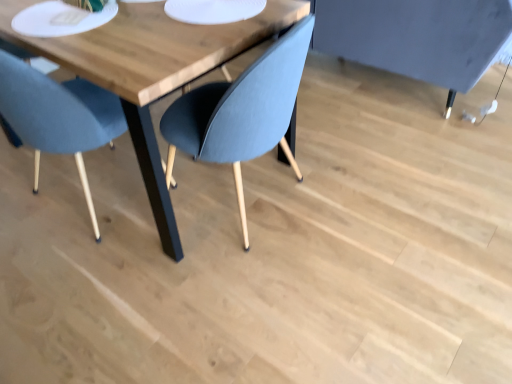
In order to click on white matte platter at upper left in this screenshot , I will do `click(61, 19)`.

Who is bigger, wooden table at center or white matte platter at upper left?

Bigger between the two is wooden table at center.

Is point (136, 109) in front of point (55, 30)?

No.

From the image's perspective, is wooden table at center located above or below white matte platter at upper left?

Clearly, from the image's perspective, wooden table at center is below white matte platter at upper left.

Considering the positions of objects wooden table at center and white matte platter at upper left in the image provided, who is more to the right, wooden table at center or white matte platter at upper left?

Positioned to the right is wooden table at center.

Considering the sizes of objects wooden table at center and white matte paper plate at upper center in the image provided, who is taller, wooden table at center or white matte paper plate at upper center?

wooden table at center is taller.

Can you confirm if wooden table at center is positioned to the left of white matte paper plate at upper center?

Yes.

Is wooden table at center inside the boundaries of white matte paper plate at upper center, or outside?

wooden table at center lies outside white matte paper plate at upper center.

From the image's perspective, which one is positioned lower, wooden table at center or white matte paper plate at upper center?

wooden table at center, from the image's perspective.

Is matte blue chair at left looking in the opposite direction of white matte platter at upper left?

No.

Who is bigger, matte blue chair at left or white matte platter at upper left?

With larger size is matte blue chair at left.

Considering the positions of objects matte blue chair at left and white matte platter at upper left in the image provided, who is more to the right, matte blue chair at left or white matte platter at upper left?

white matte platter at upper left.

Who is taller, matte blue chair at left or white matte platter at upper left?

With more height is matte blue chair at left.

Is white matte paper plate at upper center inside the boundaries of white matte platter at upper left, or outside?

white matte paper plate at upper center exists outside the volume of white matte platter at upper left.

Between point (197, 17) and point (36, 12), which one is positioned in front?

Positioned in front is point (197, 17).

Considering the sizes of objects white matte paper plate at upper center and white matte platter at upper left in the image provided, who is shorter, white matte paper plate at upper center or white matte platter at upper left?

white matte platter at upper left.

Does white matte paper plate at upper center appear on the left side of white matte platter at upper left?

Incorrect, white matte paper plate at upper center is not on the left side of white matte platter at upper left.

Is there a large distance between white matte platter at upper left and white matte paper plate at upper center?

No, white matte platter at upper left is in close proximity to white matte paper plate at upper center.

Considering their positions, is white matte platter at upper left located in front of or behind white matte paper plate at upper center?

Answer: white matte platter at upper left is positioned closer to the viewer than white matte paper plate at upper center.

From the image's perspective, is white matte platter at upper left located beneath white matte paper plate at upper center?

Indeed, from the image's perspective, white matte platter at upper left is shown beneath white matte paper plate at upper center.

Considering the relative positions of white matte platter at upper left and white matte paper plate at upper center in the image provided, is white matte platter at upper left to the right of white matte paper plate at upper center from the viewer's perspective?

No.

Which of these two, white matte paper plate at upper center or wooden table at center, is bigger?

wooden table at center.

In the scene shown: Considering the sizes of objects white matte paper plate at upper center and wooden table at center in the image provided, who is wider, white matte paper plate at upper center or wooden table at center?

Wider between the two is wooden table at center.

From a real-world perspective, which object rests below the other?

wooden table at center, from a real-world perspective.

Is white matte paper plate at upper center oriented away from wooden table at center?

No, white matte paper plate at upper center is not facing away from wooden table at center.

From the image's perspective, is white matte paper plate at upper center located beneath matte blue chair at left?

No, from the image's perspective, white matte paper plate at upper center is not beneath matte blue chair at left.

From the picture: Is white matte paper plate at upper center positioned far away from matte blue chair at left?

No, white matte paper plate at upper center is in close proximity to matte blue chair at left.

Is white matte paper plate at upper center thinner than matte blue chair at left?

Yes, white matte paper plate at upper center is thinner than matte blue chair at left.

Locate an element on the screen. The height and width of the screenshot is (384, 512). table lying in front of the white matte platter at upper left is located at coordinates (151, 70).

Identify the location of paper plate lying behind the wooden table at center. (213, 10).

Estimate the real-world distances between objects in this image. Which object is closer to white matte platter at upper left, white matte paper plate at upper center or wooden table at center?

The object closer to white matte platter at upper left is wooden table at center.

Looking at the image, which one is located further to wooden table at center, white matte paper plate at upper center or matte blue chair at left?

matte blue chair at left is further to wooden table at center.

From the image, which object appears to be nearer to white matte paper plate at upper center, wooden table at center or white matte platter at upper left?

wooden table at center.

From the picture: Considering their positions, is wooden table at center positioned closer to white matte platter at upper left than white matte paper plate at upper center?

wooden table at center lies closer to white matte platter at upper left than the other object.

When comparing their distances from white matte platter at upper left, does wooden table at center or matte blue chair at left seem further?

Among the two, matte blue chair at left is located further to white matte platter at upper left.

Based on their spatial positions, is white matte paper plate at upper center or white matte platter at upper left further from wooden table at center?

Among the two, white matte paper plate at upper center is located further to wooden table at center.

Considering their positions, is wooden table at center positioned further to matte blue chair at left than white matte platter at upper left?

wooden table at center.

Looking at the image, which one is located closer to white matte paper plate at upper center, matte blue chair at left or wooden table at center?

wooden table at center is closer to white matte paper plate at upper center.

At what (x,y) coordinates should I click in order to perform the action: click on platter between matte blue chair at left and white matte paper plate at upper center. Please return your answer as a coordinate pair (x, y). This screenshot has height=384, width=512. Looking at the image, I should click on (61, 19).

Locate an element on the screen. Image resolution: width=512 pixels, height=384 pixels. table between white matte platter at upper left and matte blue chair at left vertically is located at coordinates (151, 70).

Where is `table between white matte platter at upper left and white matte paper plate at upper center in the horizontal direction`? This screenshot has height=384, width=512. table between white matte platter at upper left and white matte paper plate at upper center in the horizontal direction is located at coordinates (151, 70).

Identify the location of table between matte blue chair at left and white matte paper plate at upper center. This screenshot has width=512, height=384. (151, 70).